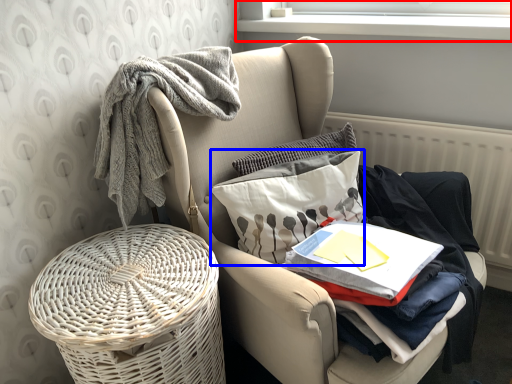
Question: Which point is closer to the camera, window screen (highlighted by a red box) or throw pillow (highlighted by a blue box)?

Choices:
 (A) window screen
 (B) throw pillow

Answer: (B)